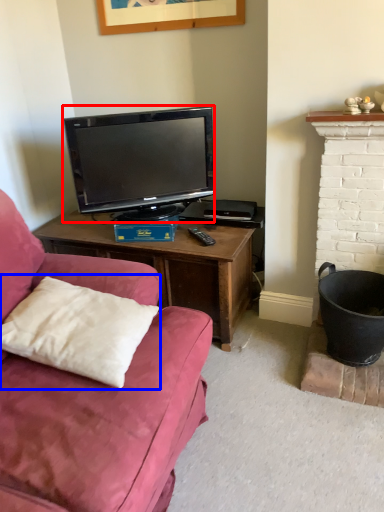
Question: Which object appears closest to the camera in this image, television (highlighted by a red box) or pillow (highlighted by a blue box)?

Choices:
 (A) television
 (B) pillow

Answer: (B)